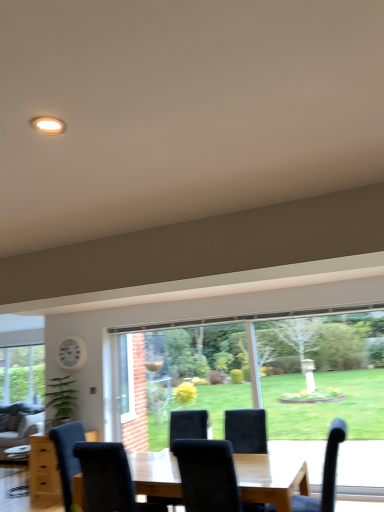
Question: Does velvet black chair at lower right, marked as the 2th chair in a left-to-right arrangement, have a smaller size compared to white plastic clock at upper left?

Choices:
 (A) no
 (B) yes

Answer: (A)

Question: From the image's perspective, is velvet black chair at lower right, marked as the 2th chair in a left-to-right arrangement, above white plastic clock at upper left?

Choices:
 (A) no
 (B) yes

Answer: (A)

Question: Is white plastic clock at upper left surrounded by velvet black chair at lower right, marked as the 2th chair in a left-to-right arrangement?

Choices:
 (A) no
 (B) yes

Answer: (A)

Question: Can you confirm if velvet black chair at lower right, marked as the 2th chair in a left-to-right arrangement, is wider than white plastic clock at upper left?

Choices:
 (A) yes
 (B) no

Answer: (A)

Question: Is velvet black chair at lower right, acting as the 1th chair starting from the right, far away from white plastic clock at upper left?

Choices:
 (A) yes
 (B) no

Answer: (A)

Question: Does point (19, 442) appear closer or farther from the camera than point (332, 446)?

Choices:
 (A) closer
 (B) farther

Answer: (B)

Question: In terms of width, does velvet grey couch at lower left look wider or thinner when compared to velvet black chair at lower right, acting as the 1th chair starting from the right?

Choices:
 (A) thin
 (B) wide

Answer: (B)

Question: Considering the positions of velvet grey couch at lower left and velvet black chair at lower right, acting as the 1th chair starting from the right, in the image, is velvet grey couch at lower left taller or shorter than velvet black chair at lower right, acting as the 1th chair starting from the right,?

Choices:
 (A) tall
 (B) short

Answer: (A)

Question: From the image's perspective, relative to velvet black chair at lower right, marked as the 2th chair in a left-to-right arrangement, is velvet grey couch at lower left above or below?

Choices:
 (A) below
 (B) above

Answer: (A)

Question: In terms of height, does velvet black chair at lower right, marked as the 2th chair in a left-to-right arrangement, look taller or shorter compared to velvet black chair at center, which is the 1th chair in left-to-right order?

Choices:
 (A) tall
 (B) short

Answer: (A)

Question: In the image, is velvet black chair at lower right, marked as the 2th chair in a left-to-right arrangement, positioned in front of or behind velvet black chair at center, which is the 1th chair in left-to-right order?

Choices:
 (A) behind
 (B) front

Answer: (A)

Question: In terms of size, does velvet black chair at lower right, acting as the 1th chair starting from the right, appear bigger or smaller than velvet black chair at center, which is the 1th chair in left-to-right order?

Choices:
 (A) small
 (B) big

Answer: (B)

Question: Considering the positions of velvet black chair at lower right, acting as the 1th chair starting from the right, and velvet black chair at center, the 2th chair positioned from the right, in the image, is velvet black chair at lower right, acting as the 1th chair starting from the right, wider or thinner than velvet black chair at center, the 2th chair positioned from the right,?

Choices:
 (A) wide
 (B) thin

Answer: (B)

Question: Is white plastic clock at upper left in front of or behind velvet black chair at center, which is the 1th chair in left-to-right order, in the image?

Choices:
 (A) behind
 (B) front

Answer: (A)

Question: Considering the positions of white plastic clock at upper left and velvet black chair at center, which is the 1th chair in left-to-right order, in the image, is white plastic clock at upper left taller or shorter than velvet black chair at center, which is the 1th chair in left-to-right order,?

Choices:
 (A) tall
 (B) short

Answer: (B)